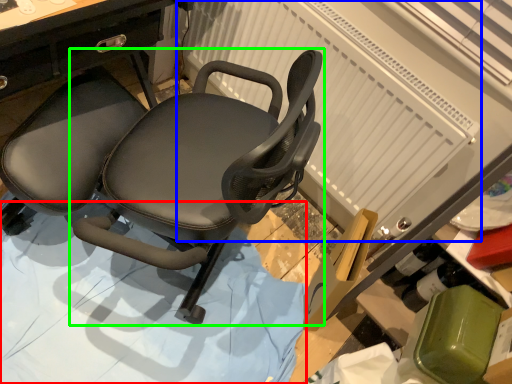
Question: Which is nearer to the surface (highlighted by a red box)? radiator (highlighted by a blue box) or chair (highlighted by a green box).

Choices:
 (A) radiator
 (B) chair

Answer: (B)